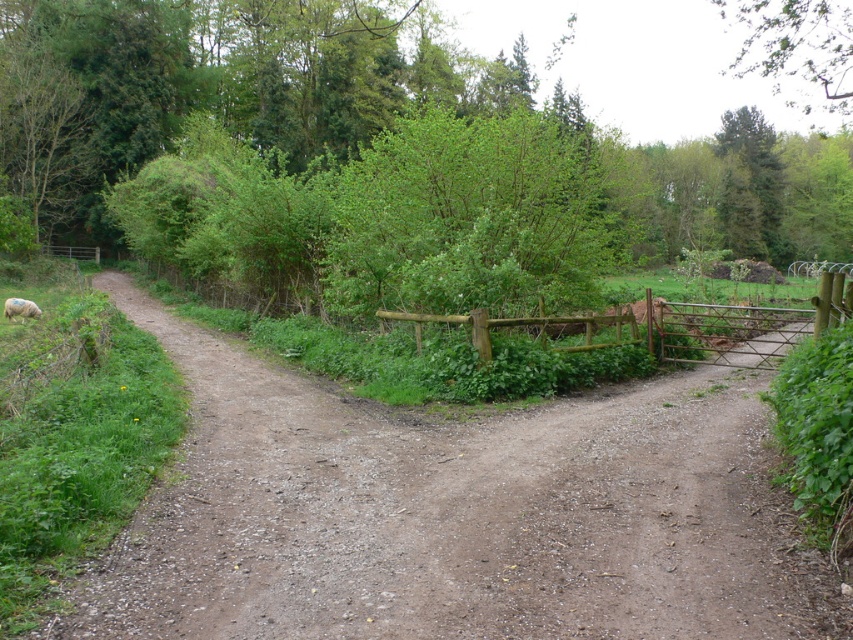
Question: Does green leafy tree at upper right have a smaller size compared to white woolly sheep at lower left?

Choices:
 (A) yes
 (B) no

Answer: (B)

Question: Which point is closer to the camera?

Choices:
 (A) (688, 532)
 (B) (9, 317)

Answer: (A)

Question: Which is nearer to the brown gravel dirt track at center?

Choices:
 (A) brown wooden fence at center
 (B) green leafy tree at upper right
 (C) white woolly sheep at lower left

Answer: (A)

Question: Is green leafy tree at upper right to the right of white woolly sheep at lower left from the viewer's perspective?

Choices:
 (A) yes
 (B) no

Answer: (A)

Question: Can you confirm if brown gravel dirt track at center is positioned to the right of green leafy tree at upper right?

Choices:
 (A) no
 (B) yes

Answer: (A)

Question: Which of the following is the farthest from the observer?

Choices:
 (A) (24, 312)
 (B) (799, 33)
 (C) (409, 317)
 (D) (440, 467)

Answer: (B)